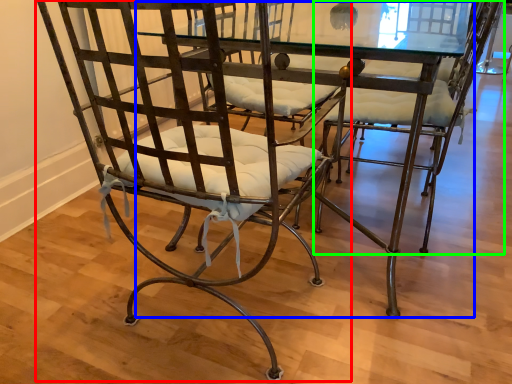
Question: Which is farther away from chair (highlighted by a red box)? round table (highlighted by a blue box) or chair (highlighted by a green box)?

Choices:
 (A) round table
 (B) chair

Answer: (B)